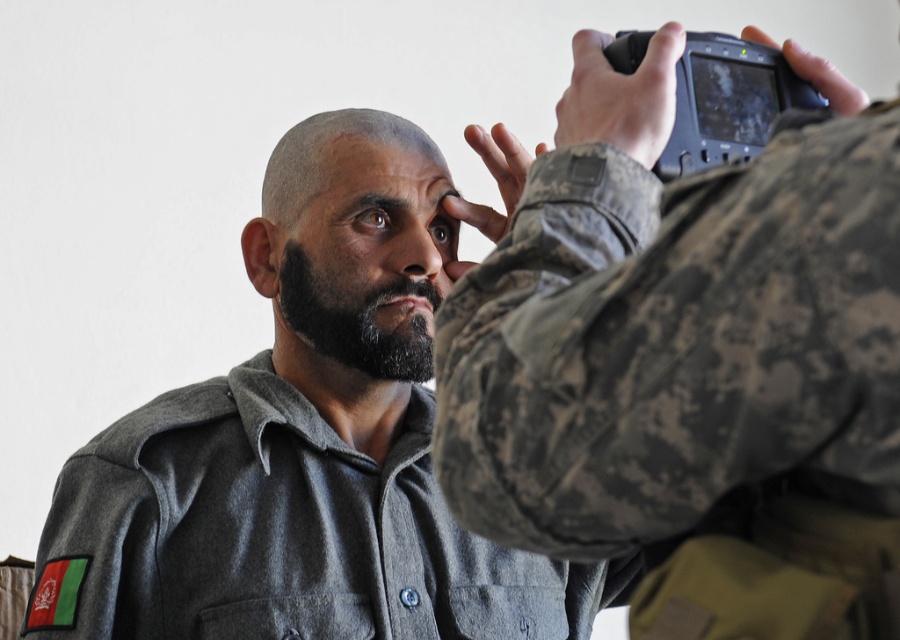
Question: Is camouflage fabric at upper right to the left of gray matte shirt at center from the viewer's perspective?

Choices:
 (A) no
 (B) yes

Answer: (A)

Question: Can you confirm if camouflage fabric at upper right is positioned to the right of gray matte shirt at center?

Choices:
 (A) no
 (B) yes

Answer: (B)

Question: Which point is farther from the camera taking this photo?

Choices:
 (A) (780, 269)
 (B) (294, 420)

Answer: (B)

Question: Among these points, which one is nearest to the camera?

Choices:
 (A) (351, 134)
 (B) (560, 509)

Answer: (B)

Question: Does camouflage fabric at upper right lie behind gray matte shirt at center?

Choices:
 (A) no
 (B) yes

Answer: (A)